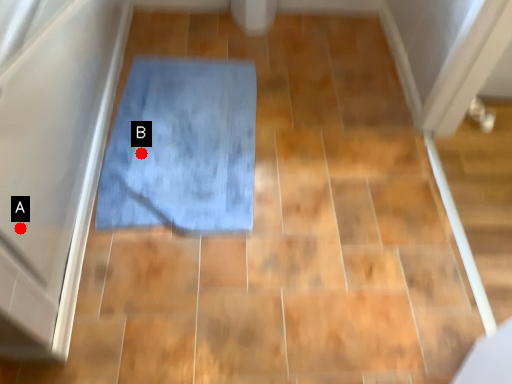
Question: Two points are circled on the image, labeled by A and B beside each circle. Which point is closer to the camera taking this photo?

Choices:
 (A) A is closer
 (B) B is closer

Answer: (A)